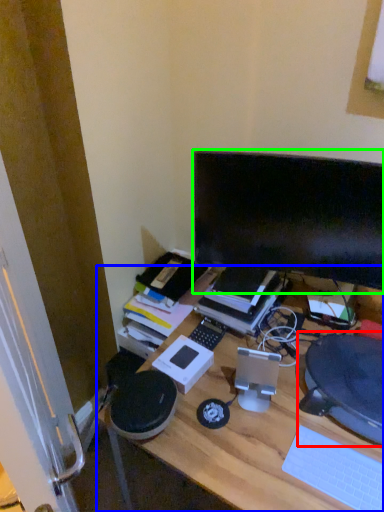
Question: Considering the real-world distances, which object is farthest from computer chair (highlighted by a red box)? desk (highlighted by a blue box) or computer monitor (highlighted by a green box)?

Choices:
 (A) desk
 (B) computer monitor

Answer: (B)